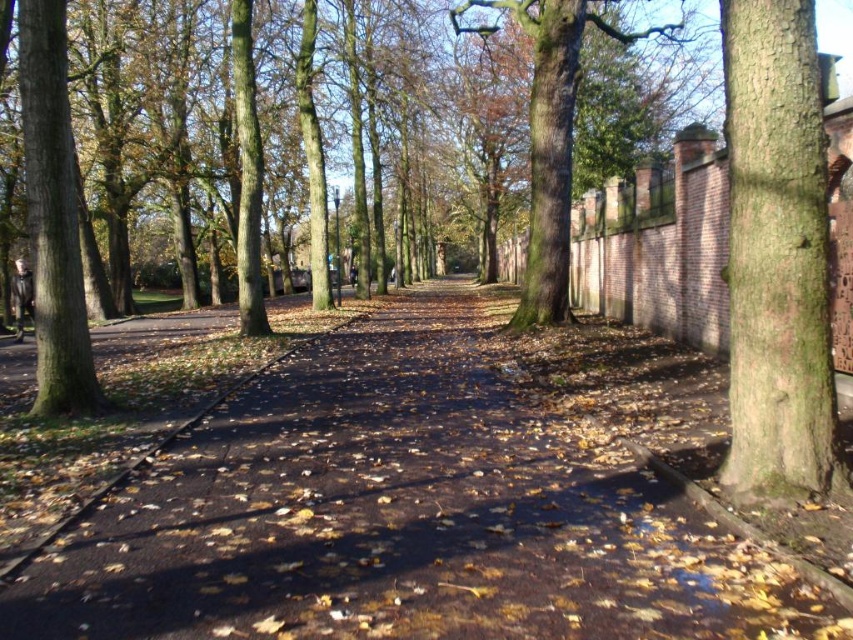
You are standing at the entrance of the park and want to walk along the brown asphalt pavement at center. According to the coordinates provided, in which direction should you head to follow the pavement?

The brown asphalt pavement at center is located at point coordinates, so you should head towards the coordinates to follow the pavement.

You are a pedestrian walking along the brown asphalt pavement at center. You want to take a shortcut to the green rough bark tree at left. Is the tree directly above the pavement where you are standing?

Yes, the brown asphalt pavement at center is positioned under the green rough bark tree at left, so the tree is directly above the pavement where you are standing.